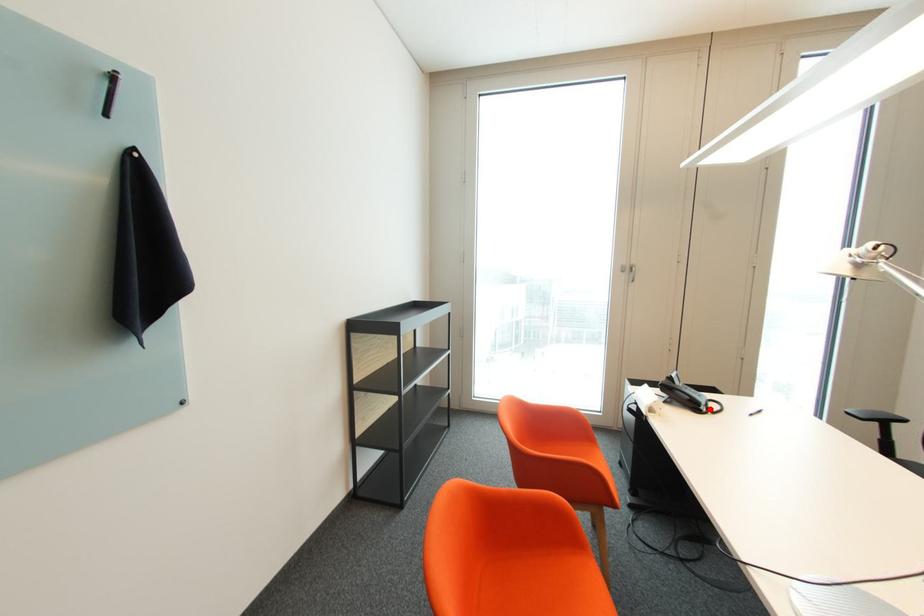
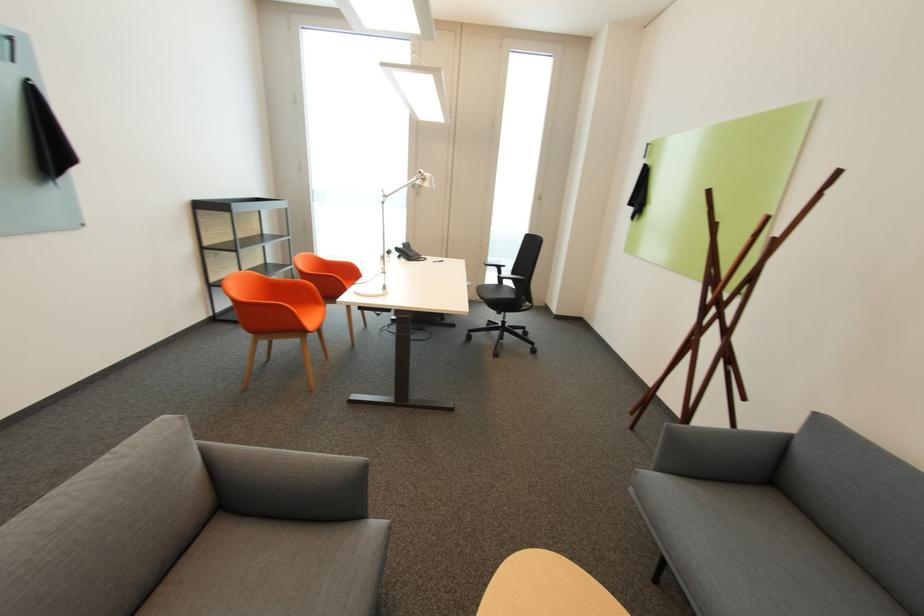
The point at the highlighted location is marked in the first image. Where is the corresponding point in the second image?

(419, 259)